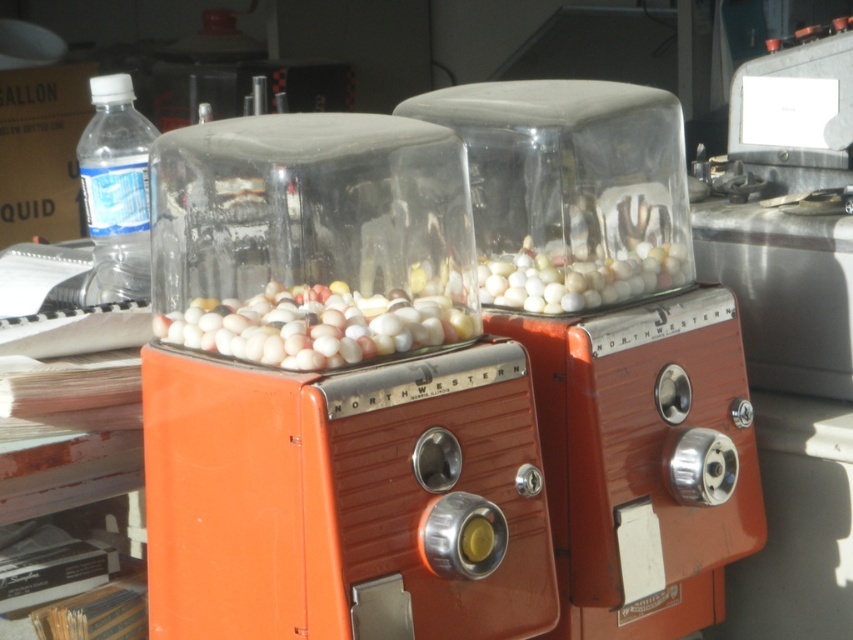
Which is below, orange metallic northwestern gumball machine at center or metallic silver appliance at right?

Positioned lower is orange metallic northwestern gumball machine at center.

Does orange metallic northwestern gumball machine at center have a lesser width compared to metallic silver appliance at right?

Incorrect, orange metallic northwestern gumball machine at center's width is not less than metallic silver appliance at right's.

Between point (753, 512) and point (822, 458), which one is positioned in front?

Point (753, 512)

The height and width of the screenshot is (640, 853). I want to click on orange metallic northwestern gumball machine at center, so click(612, 346).

Is orange metallic northwestern gumball machine at center thinner than clear plastic bottle at left?

No, orange metallic northwestern gumball machine at center is not thinner than clear plastic bottle at left.

Is point (671, 163) more distant than point (91, 77)?

No, (671, 163) is closer to viewer.

Is point (579, 340) farther from camera compared to point (103, 240)?

That is False.

The width and height of the screenshot is (853, 640). In order to click on orange metallic northwestern gumball machine at center in this screenshot , I will do `click(612, 346)`.

Can you confirm if orange metallic gumball machine at center is thinner than metallic silver appliance at right?

In fact, orange metallic gumball machine at center might be wider than metallic silver appliance at right.

Is orange metallic gumball machine at center positioned behind metallic silver appliance at right?

No, it is not.

Which is behind, point (252, 218) or point (735, 621)?

The point (735, 621) is behind.

I want to click on orange metallic gumball machine at center, so click(x=332, y=394).